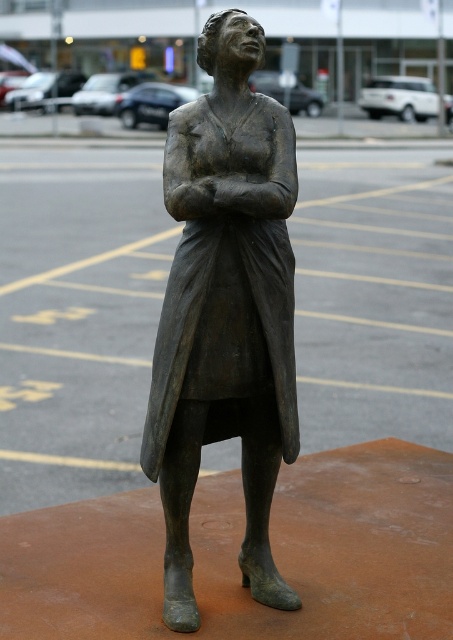
Can you confirm if bronze statue at center is positioned to the left of metallic parking lot at upper center?

Incorrect, bronze statue at center is not on the left side of metallic parking lot at upper center.

Can you confirm if bronze statue at center is shorter than metallic parking lot at upper center?

No, bronze statue at center is not shorter than metallic parking lot at upper center.

Who is more forward, (149, 460) or (96, 84)?

Point (149, 460) is in front.

Locate an element on the screen. The image size is (453, 640). bronze statue at center is located at coordinates coord(226,310).